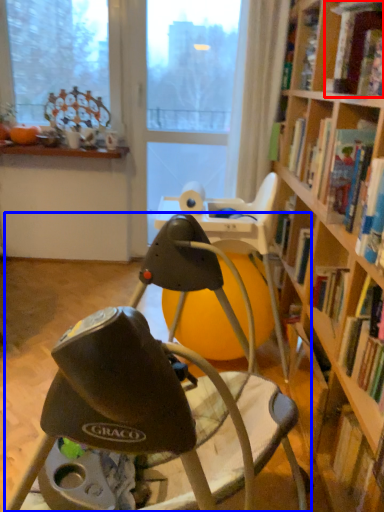
Question: Among these objects, which one is farthest to the camera, book (highlighted by a red box) or chair (highlighted by a blue box)?

Choices:
 (A) book
 (B) chair

Answer: (A)